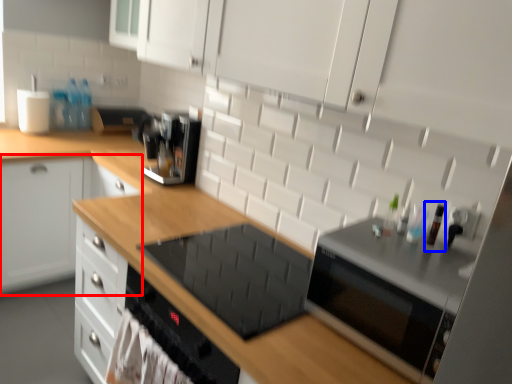
Question: Among these objects, which one is nearest to the camera, cabinetry (highlighted by a red box) or bottle (highlighted by a blue box)?

Choices:
 (A) cabinetry
 (B) bottle

Answer: (B)